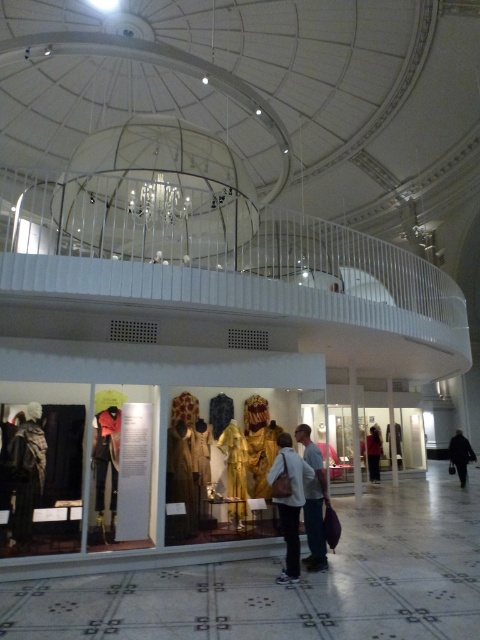
You are a security guard in the museum and need to ensure that all items in the display case are visible through the glass. The gold textured fabric at center and the dark brown leather jacket at center are two items you need to check. Which item is taller and might block the view of smaller items behind it?

The gold textured fabric at center is taller than the dark brown leather jacket at center, so it might block the view of smaller items behind it.